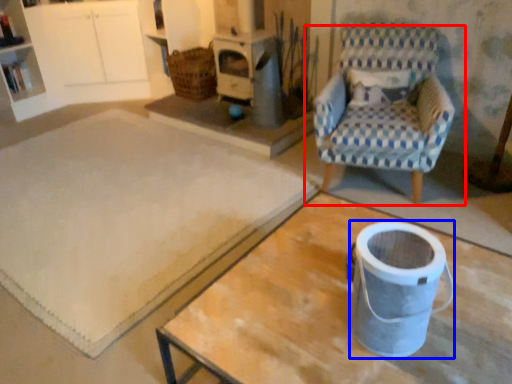
Question: Which object is closer to the camera taking this photo, chair (highlighted by a red box) or appliance (highlighted by a blue box)?

Choices:
 (A) chair
 (B) appliance

Answer: (B)